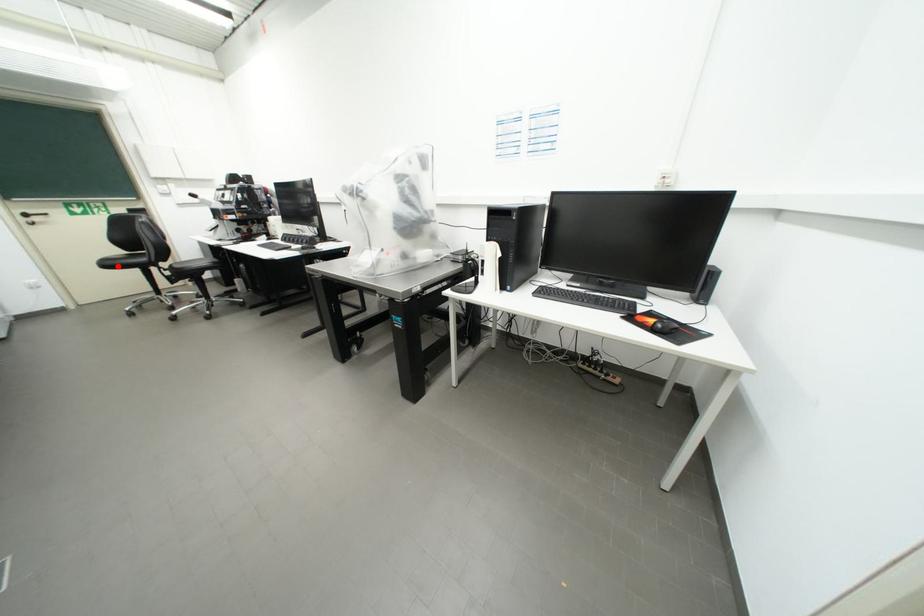
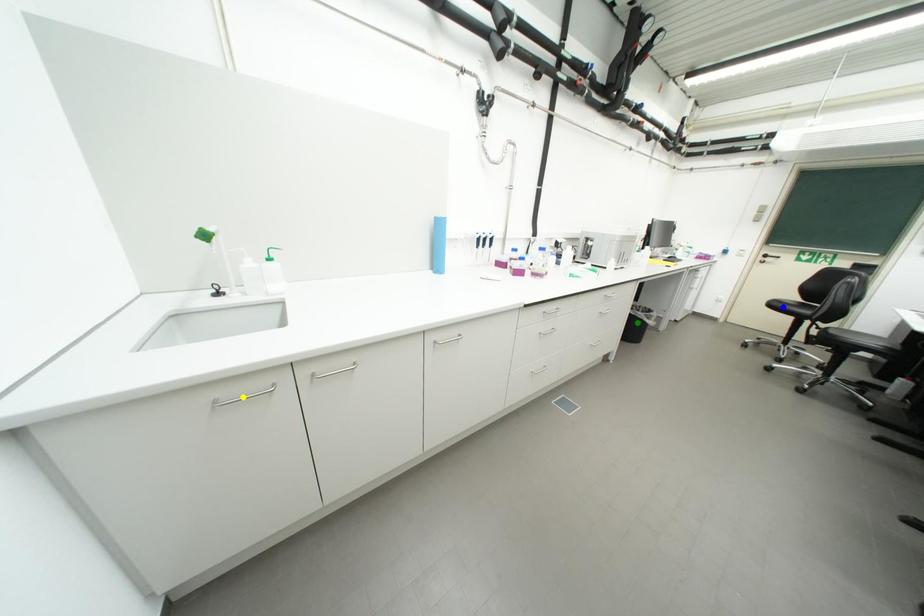
Question: I am providing you with two images of the same scene from different viewpoints. A red point is marked on the first image. You are given multiple points on the second image. Which point in image 2 represents the same 3d spot as the red point in image 1?

Choices:
 (A) yellow point
 (B) blue point
 (C) green point

Answer: (B)